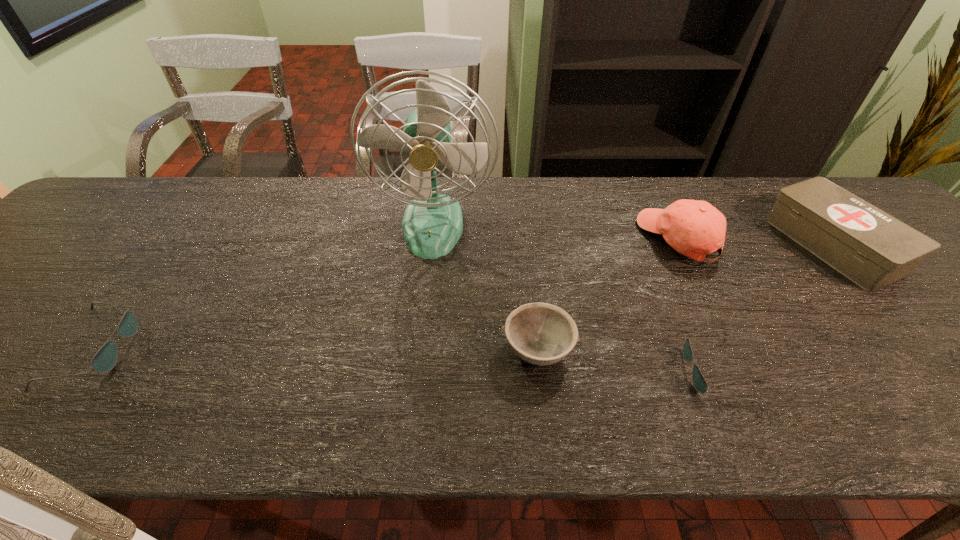
To make them evenly spaced by inserting another sunglasses among them, please locate a vacant spot for this new sunglasses. Please provide its 2D coordinates. Your answer should be formatted as a tuple, i.e. [(x, y)], where the tuple contains the x and y coordinates of a point satisfying the conditions above.

[(398, 360)]